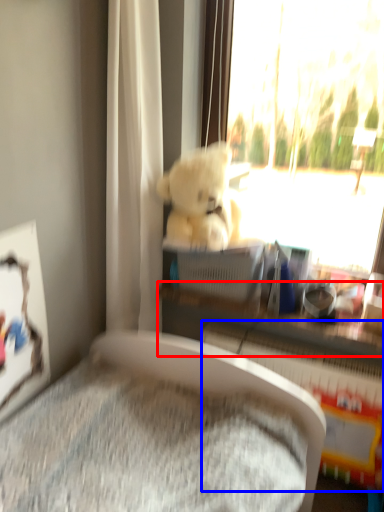
Question: Which point is further to the camera, shelf (highlighted by a red box) or radiator (highlighted by a blue box)?

Choices:
 (A) shelf
 (B) radiator

Answer: (A)